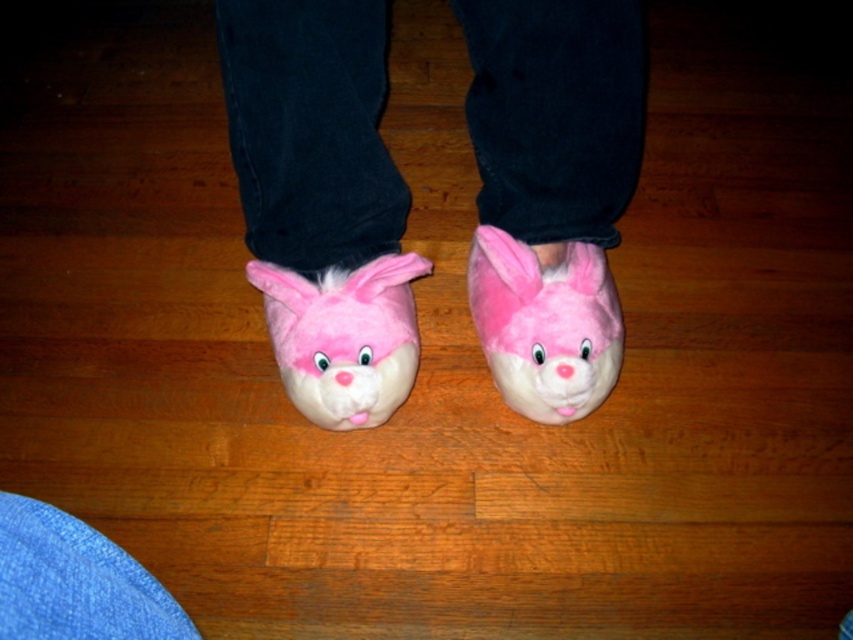
You are designing a shoe display stand that needs to accommodate both the fluffy pink slippers at center and the fluffy pink plush at center. Given their sizes, which one requires a wider space on the stand?

The fluffy pink slippers at center require a wider space on the stand since their width is larger than the fluffy pink plush at center.

You are standing in a room with a wooden floor. You see the fluffy pink slippers at center. Where are they located in terms of coordinates?

The fluffy pink slippers at center are located at coordinates point (x=322, y=200).